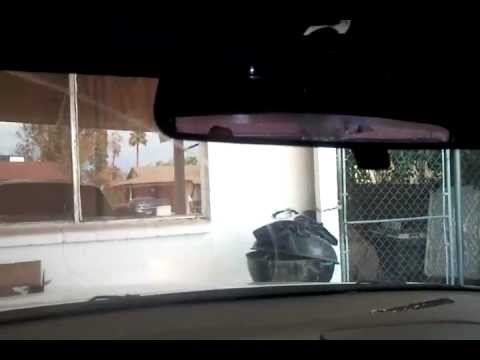
The width and height of the screenshot is (480, 360). Find the location of `plant`. plant is located at coordinates (401, 165).